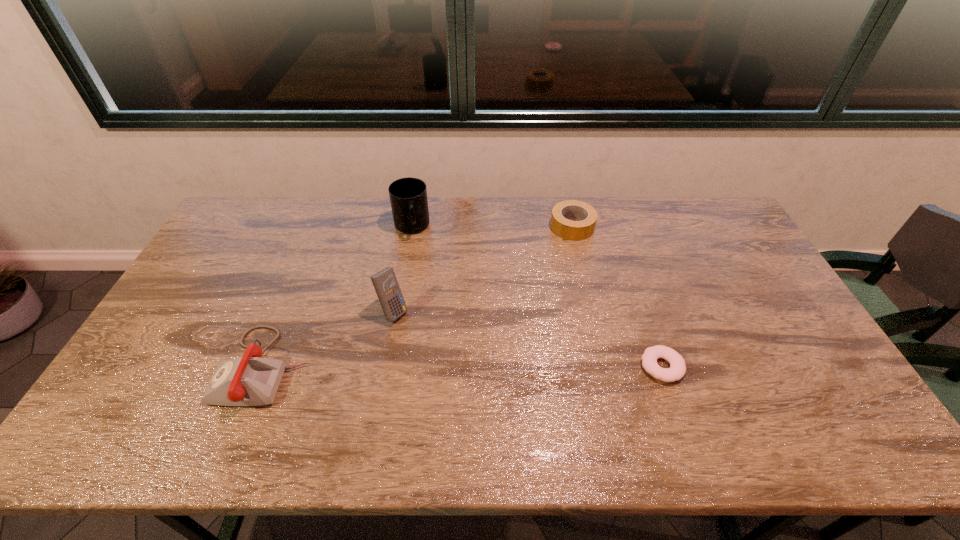
Find the location of a particular element. This screenshot has width=960, height=540. free spot located 0.220m on the dial of the third tallest object is located at coordinates (139, 367).

The image size is (960, 540). Find the location of `free spot located on the right of the doughnut`. free spot located on the right of the doughnut is located at coordinates (740, 367).

Locate an element on the screen. free region located at the edge of the duct tape is located at coordinates (549, 272).

You are a GUI agent. You are given a task and a screenshot of the screen. Output one action in this format:
    pyautogui.click(x=<x>, y=<y>)
    Task: Click on the free space located at the edge of the duct tape
    This screenshot has height=540, width=960.
    Given the screenshot: What is the action you would take?
    pyautogui.click(x=541, y=287)

This screenshot has width=960, height=540. What are the coordinates of `free space located 0.080m at the edge of the duct tape` in the screenshot? It's located at (559, 254).

At what (x,y) coordinates should I click in order to perform the action: click on vacant space located on the side of the mug with the handle. Please return your answer as a coordinate pair (x, y). The height and width of the screenshot is (540, 960). Looking at the image, I should click on 423,289.

The height and width of the screenshot is (540, 960). I want to click on free space located on the side of the mug with the handle, so click(x=420, y=269).

Locate an element on the screen. Image resolution: width=960 pixels, height=540 pixels. vacant space located 0.100m on the side of the mug with the handle is located at coordinates (418, 261).

Where is `vacant space located on the front-facing side of the calculator`? This screenshot has height=540, width=960. vacant space located on the front-facing side of the calculator is located at coordinates (415, 330).

At what (x,y) coordinates should I click in order to perform the action: click on vacant space positioned on the front-facing side of the calculator. Please return your answer as a coordinate pair (x, y). The height and width of the screenshot is (540, 960). Looking at the image, I should click on (459, 363).